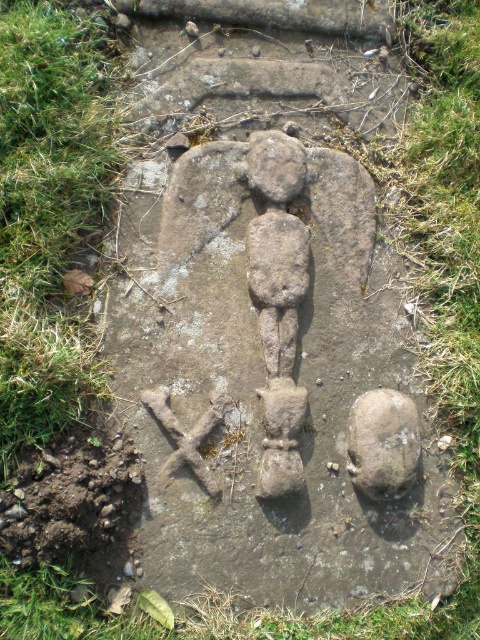
Image resolution: width=480 pixels, height=640 pixels. Describe the element at coordinates (383, 444) in the screenshot. I see `rusty stone at lower right` at that location.

Does rusty stone at lower right appear under rough stone head at center?

Yes.

Describe the element at coordinates (383, 444) in the screenshot. I see `rusty stone at lower right` at that location.

Find the location of `rusty stone at lower right`. rusty stone at lower right is located at coordinates (383, 444).

Between green grass at lower left and rough stone head at center, which one is positioned lower?

Positioned lower is green grass at lower left.

The height and width of the screenshot is (640, 480). What are the coordinates of `green grass at lower left` in the screenshot? It's located at (48, 214).

Is green grass at lower left thinner than rusty stone at lower right?

Incorrect, green grass at lower left's width is not less than rusty stone at lower right's.

Which is more to the right, green grass at lower left or rusty stone at lower right?

Positioned to the right is rusty stone at lower right.

Does point (87, 36) come farther from viewer compared to point (385, 401)?

No, it is in front of (385, 401).

What are the coordinates of `green grass at lower left` in the screenshot? It's located at (48, 214).